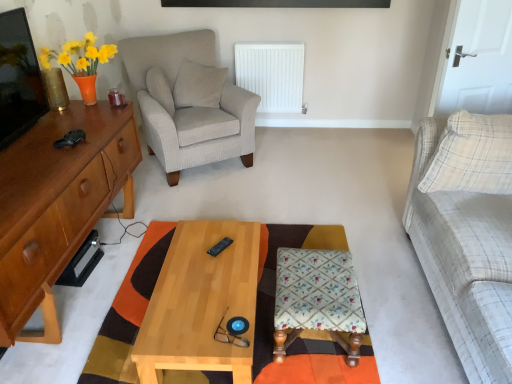
I want to click on free space that is in between plaid fabric couch at right and floral fabric stool at center, so tap(382, 302).